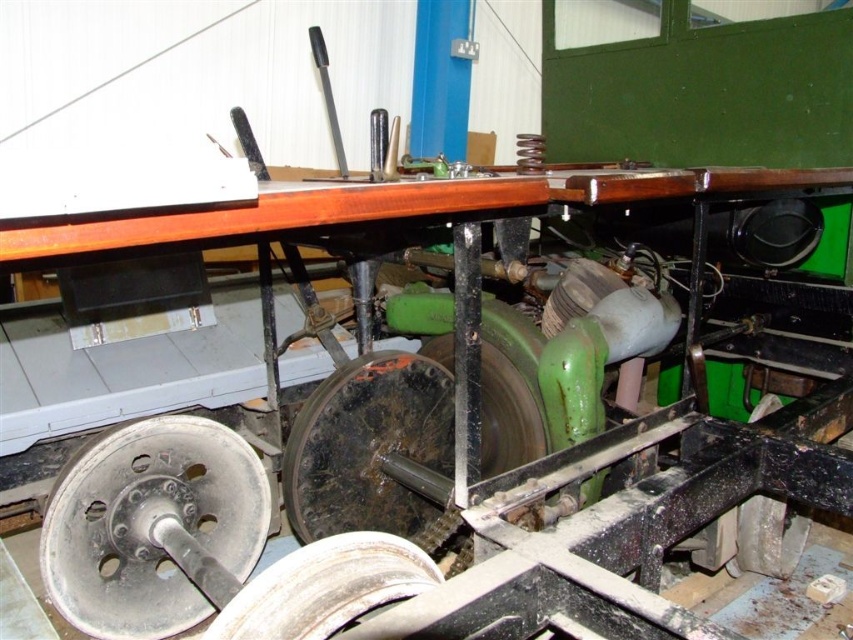
You are an engineer inspecting a mechanical system. You notice two wheels in the system. The gray metallic wheel at lower left and the black rubber wheel at lower right. Which wheel has a greater width?

The gray metallic wheel at lower left has a greater width than the black rubber wheel at lower right according to the description.

Where is the white rubber wheel at center located in the image?

The white rubber wheel at center is located at point [325,588].

Based on the photo, you are an engineer inspecting the machinery. You notice two points marked on the image at coordinates point (373,566) and point (764,509). Based on their positions, which point is closer to you?

Point (373,566) is in front of point (764,509), so it is closer to you.